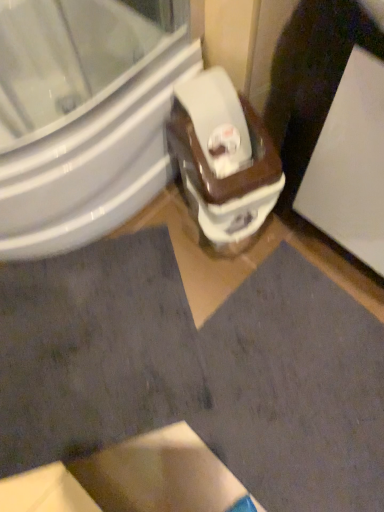
Question: From the image's perspective, is dark gray fabric at lower left below white glossy toilet at center?

Choices:
 (A) no
 (B) yes

Answer: (B)

Question: Does dark gray fabric at lower left have a lesser width compared to white glossy toilet at center?

Choices:
 (A) no
 (B) yes

Answer: (A)

Question: Does dark gray fabric at lower left have a larger size compared to white glossy toilet at center?

Choices:
 (A) no
 (B) yes

Answer: (A)

Question: Could you tell me if dark gray fabric at lower left is turned towards white glossy toilet at center?

Choices:
 (A) yes
 (B) no

Answer: (B)

Question: Is dark gray fabric at lower left smaller than white glossy toilet at center?

Choices:
 (A) yes
 (B) no

Answer: (A)

Question: Which is correct: white glossy bidet at center is inside white glossy screen door at upper right, or outside of it?

Choices:
 (A) outside
 (B) inside

Answer: (A)

Question: From a real-world perspective, is white glossy bidet at center positioned above or below white glossy screen door at upper right?

Choices:
 (A) below
 (B) above

Answer: (A)

Question: Would you say white glossy bidet at center is to the left or to the right of white glossy screen door at upper right in the picture?

Choices:
 (A) left
 (B) right

Answer: (A)

Question: In the image, is white glossy bidet at center positioned in front of or behind white glossy screen door at upper right?

Choices:
 (A) front
 (B) behind

Answer: (B)

Question: From the image's perspective, is dark gray fabric at lower left above or below white glossy screen door at upper right?

Choices:
 (A) below
 (B) above

Answer: (A)

Question: From a real-world perspective, relative to white glossy screen door at upper right, is dark gray fabric at lower left vertically above or below?

Choices:
 (A) above
 (B) below

Answer: (B)

Question: Is dark gray fabric at lower left to the left or to the right of white glossy screen door at upper right in the image?

Choices:
 (A) left
 (B) right

Answer: (A)

Question: Looking at the image, does dark gray fabric at lower left seem bigger or smaller compared to white glossy screen door at upper right?

Choices:
 (A) small
 (B) big

Answer: (A)

Question: From a real-world perspective, is white glossy screen door at upper right positioned above or below white glossy toilet at center?

Choices:
 (A) below
 (B) above

Answer: (B)

Question: Considering the positions of point (379, 135) and point (231, 226), is point (379, 135) closer or farther from the camera than point (231, 226)?

Choices:
 (A) farther
 (B) closer

Answer: (B)